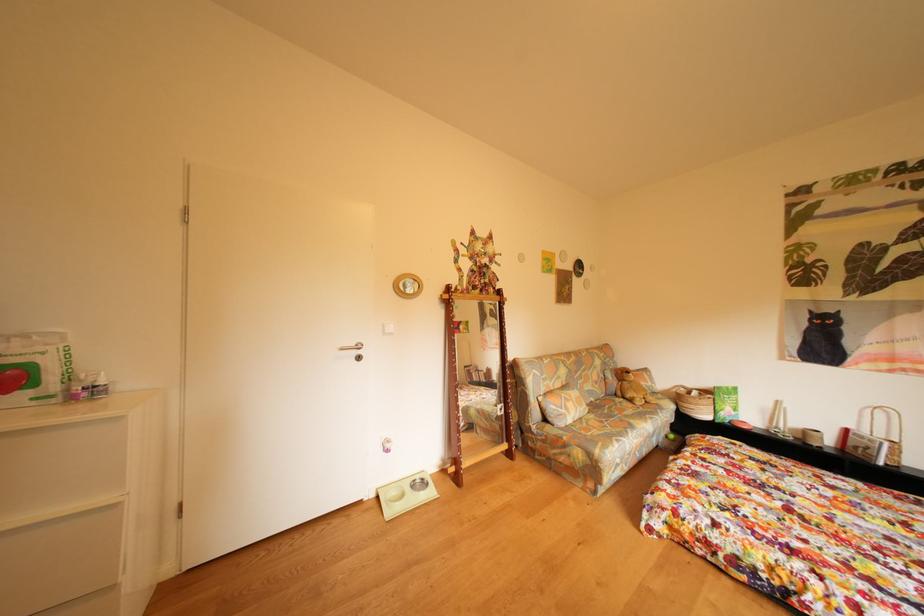
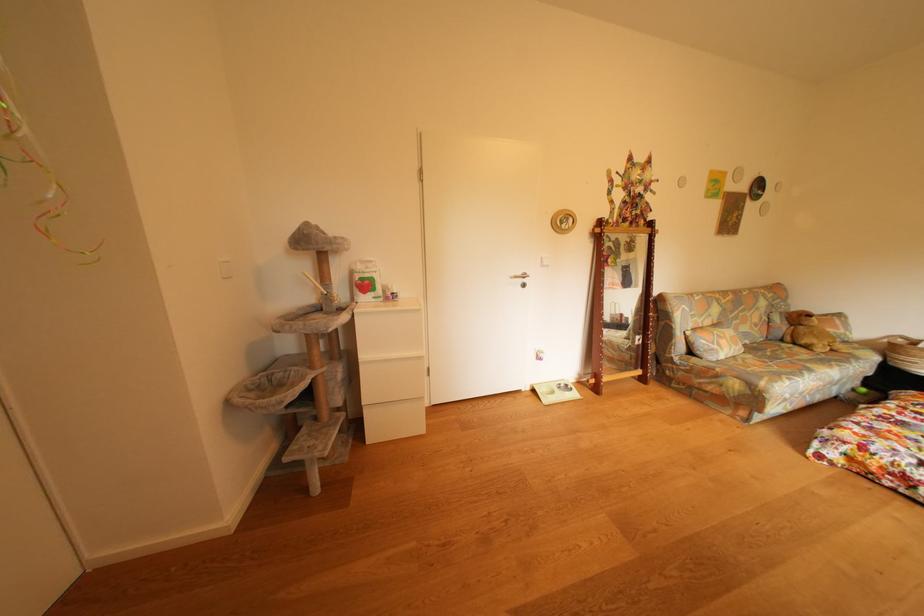
Question: The camera is either moving clockwise (left) or counter-clockwise (right) around the object. The first image is from the beginning of the video and the second image is from the end. Is the camera moving left or right when shooting the video?

Choices:
 (A) Left
 (B) Right

Answer: (B)